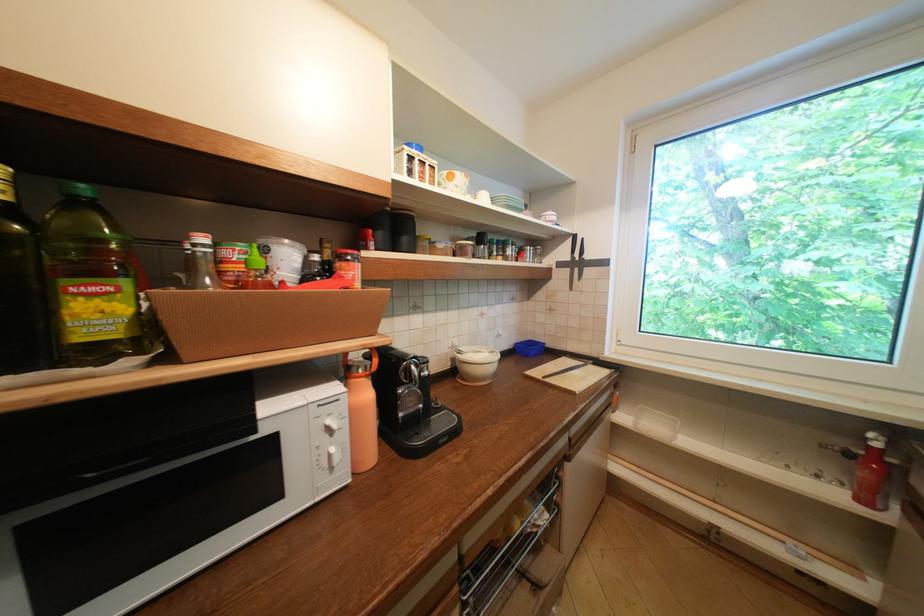
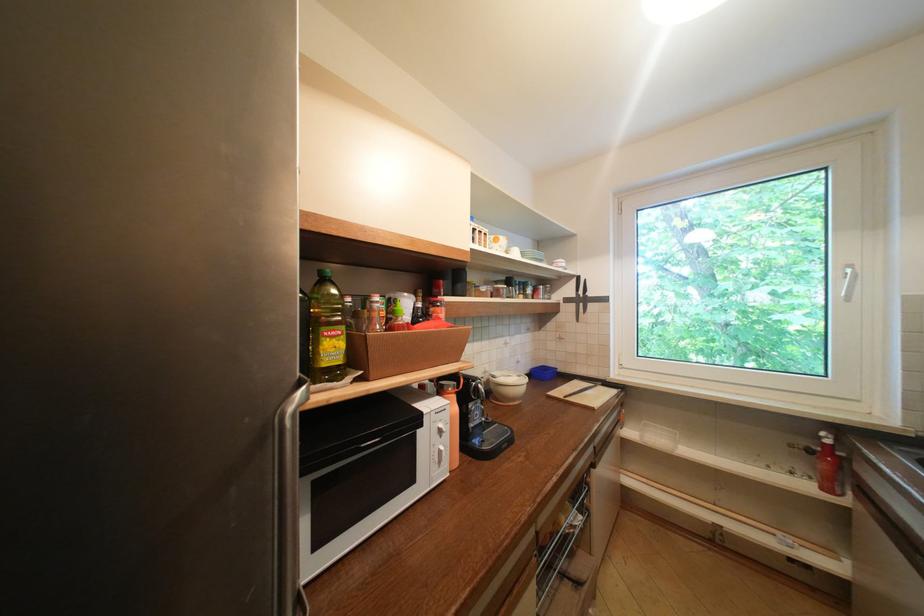
The point at [874,440] is marked in the first image. Where is the corresponding point in the second image?

(829, 439)